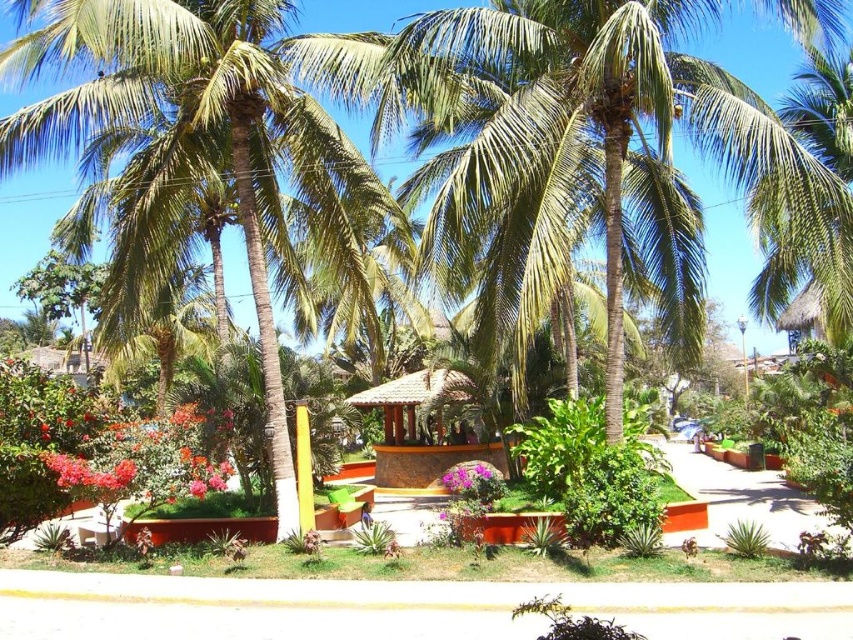
Does purple matte flower at center come in front of pink matte flower at center?

Yes, purple matte flower at center is closer to the viewer.

Who is taller, purple matte flower at center or pink matte flower at center?

purple matte flower at center is taller.

Which is behind, point (460, 483) or point (496, 468)?

The point (496, 468) is behind.

This screenshot has width=853, height=640. I want to click on purple matte flower at center, so click(x=469, y=476).

Is green leafy coconut tree at center in front of purple matte flower at center?

Yes, green leafy coconut tree at center is in front of purple matte flower at center.

Who is more forward, (155, 202) or (456, 492)?

Point (155, 202) is more forward.

Which is in front, point (271, 371) or point (477, 460)?

Point (271, 371) is more forward.

The width and height of the screenshot is (853, 640). I want to click on green leafy coconut tree at center, so click(219, 132).

Based on the photo, can you confirm if vivid red petals at lower left is smaller than purple matte flower at center?

Yes.

Is vivid red petals at lower left below purple matte flower at center?

Incorrect, vivid red petals at lower left is not positioned below purple matte flower at center.

This screenshot has width=853, height=640. Find the location of `vivid red petals at lower left`. vivid red petals at lower left is located at coordinates (143, 461).